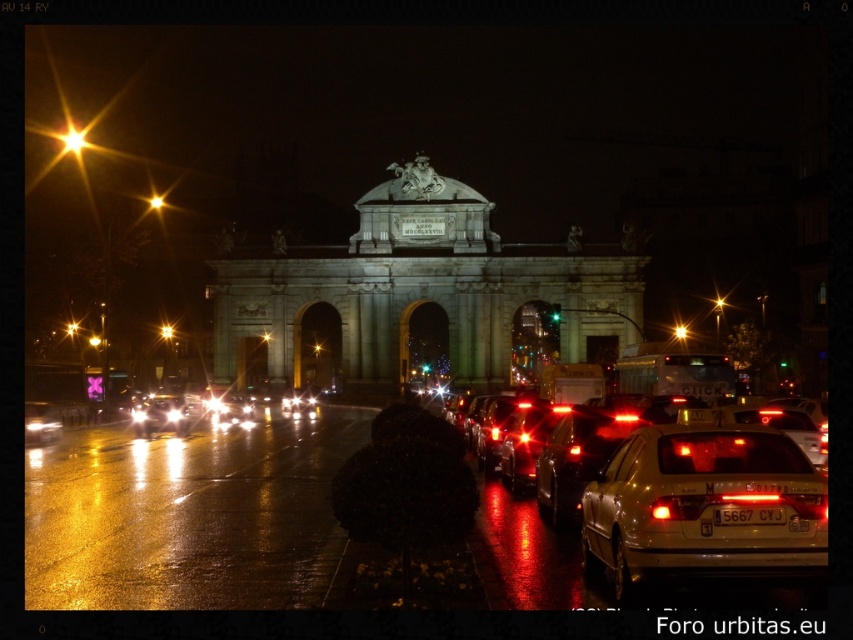
Question: Which object is closer to the camera taking this photo?

Choices:
 (A) bright metallic starburst at upper left
 (B) matte black car at center

Answer: (B)

Question: Does metallic gold sedan at center-right appear on the left side of metallic starburst at upper left?

Choices:
 (A) no
 (B) yes

Answer: (A)

Question: Which point is closer to the camera taking this photo?

Choices:
 (A) (688, 333)
 (B) (164, 339)

Answer: (A)

Question: Does metallic gold sedan at center-right have a larger size compared to shiny silver car at lower left?

Choices:
 (A) no
 (B) yes

Answer: (B)

Question: Does metallic starburst at upper left lie behind metallic yellow light at center?

Choices:
 (A) no
 (B) yes

Answer: (B)

Question: Which point is farther to the camera?

Choices:
 (A) bright metallic starburst at center
 (B) metallic gold taxi at center

Answer: (A)